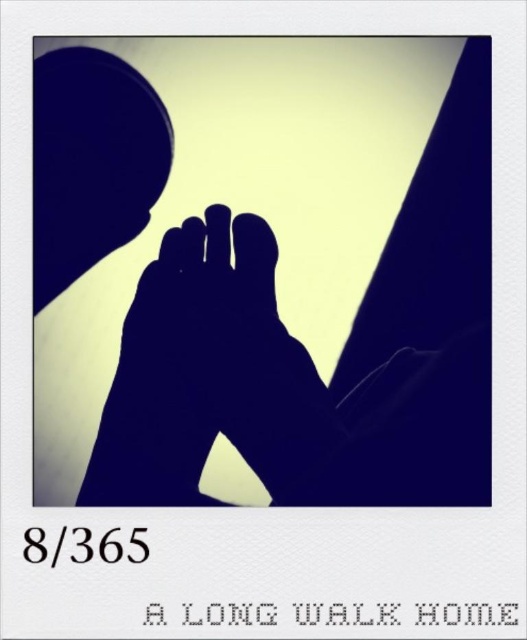
Question: Does black matte feet at center lie behind black matte hand at center?

Choices:
 (A) no
 (B) yes

Answer: (A)

Question: Can you confirm if black matte feet at center is wider than black matte hand at center?

Choices:
 (A) no
 (B) yes

Answer: (B)

Question: Which object is closer to the camera taking this photo?

Choices:
 (A) black matte feet at center
 (B) black matte hand at center

Answer: (A)

Question: Which point appears closest to the camera in this image?

Choices:
 (A) (451, 93)
 (B) (193, 490)

Answer: (B)

Question: Which object appears closest to the camera in this image?

Choices:
 (A) black matte hand at center
 (B) black matte feet at center

Answer: (B)

Question: Is black matte feet at center above black matte hand at center?

Choices:
 (A) yes
 (B) no

Answer: (A)